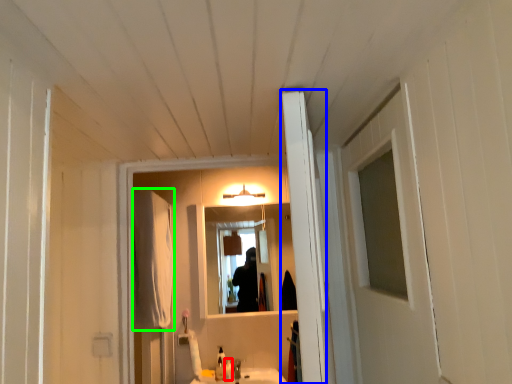
Question: Which is nearer to the toiletry (highlighted by a red box)? door (highlighted by a blue box) or curtain (highlighted by a green box).

Choices:
 (A) door
 (B) curtain

Answer: (B)